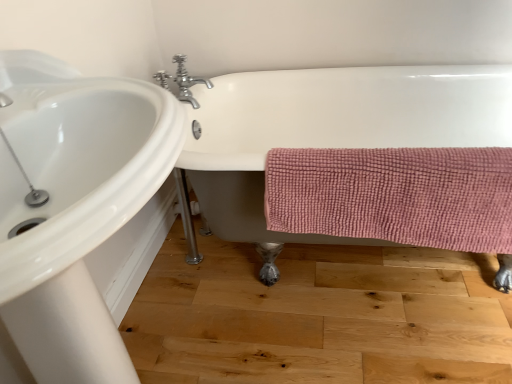
In order to click on white glossy bathtub at center in this screenshot , I will do `click(325, 132)`.

Identify the location of pink textured towel at lower right. The image size is (512, 384). (395, 195).

I want to click on chrome metallic faucet at upper center, so click(187, 82).

Could you tell me if chrome metallic faucet at upper center is facing pink textured towel at lower right?

No.

I want to click on bath towel that appears in front of the chrome metallic faucet at upper center, so click(395, 195).

Is chrome metallic faucet at upper center shorter than pink textured towel at lower right?

Yes, chrome metallic faucet at upper center is shorter than pink textured towel at lower right.

Which object is positioned more to the right, chrome metallic faucet at upper center or pink textured towel at lower right?

From the viewer's perspective, pink textured towel at lower right appears more on the right side.

Is white glossy bathtub at center smaller than white glossy sink at upper left?

Incorrect, white glossy bathtub at center is not smaller in size than white glossy sink at upper left.

I want to click on bathtub that appears on the right of white glossy sink at upper left, so click(325, 132).

Is point (277, 115) closer or farther from the camera than point (90, 153)?

Point (277, 115) is positioned farther from the camera compared to point (90, 153).

Do you think white glossy bathtub at center is within white glossy sink at upper left, or outside of it?

white glossy bathtub at center lies outside white glossy sink at upper left.

Which of these two, white glossy bathtub at center or chrome metallic faucet at upper center, stands shorter?

Standing shorter between the two is chrome metallic faucet at upper center.

Based on the photo, how different are the orientations of white glossy bathtub at center and chrome metallic faucet at upper center in degrees?

There is a 88.8-degree angle between the facing directions of white glossy bathtub at center and chrome metallic faucet at upper center.

Based on the photo, is there a large distance between white glossy bathtub at center and chrome metallic faucet at upper center?

They are positioned close to each other.

From the image's perspective, relative to chrome metallic faucet at upper center, is white glossy bathtub at center above or below?

white glossy bathtub at center is situated lower than chrome metallic faucet at upper center in the image.

What's the angular difference between white glossy sink at upper left and white glossy bathtub at center's facing directions?

There is a 89.4-degree angle between the facing directions of white glossy sink at upper left and white glossy bathtub at center.

Between white glossy sink at upper left and white glossy bathtub at center, which one has larger size?

With larger size is white glossy bathtub at center.

Is white glossy sink at upper left at the left side of white glossy bathtub at center?

Yes.

Is white glossy sink at upper left far from white glossy bathtub at center?

No, white glossy sink at upper left is not far from white glossy bathtub at center.

Is pink textured towel at lower right facing away from white glossy sink at upper left?

pink textured towel at lower right is not turned away from white glossy sink at upper left.

Is pink textured towel at lower right far from white glossy sink at upper left?

They are positioned close to each other.

Do you think pink textured towel at lower right is within white glossy sink at upper left, or outside of it?

pink textured towel at lower right is located beyond the bounds of white glossy sink at upper left.

Between pink textured towel at lower right and white glossy sink at upper left, which one is positioned in front?

white glossy sink at upper left is closer to the camera.

Does point (354, 151) lie behind point (291, 93)?

No, (354, 151) is closer to viewer.

Considering the relative positions of pink textured towel at lower right and white glossy bathtub at center in the image provided, is pink textured towel at lower right behind white glossy bathtub at center?

Yes, it is.

In terms of width, does pink textured towel at lower right look wider or thinner when compared to white glossy bathtub at center?

Clearly, pink textured towel at lower right has less width compared to white glossy bathtub at center.

Which is correct: pink textured towel at lower right is inside white glossy bathtub at center, or outside of it?

pink textured towel at lower right exists entirely within white glossy bathtub at center.

Does chrome metallic faucet at upper center have a larger size compared to white glossy bathtub at center?

Actually, chrome metallic faucet at upper center might be smaller than white glossy bathtub at center.

The image size is (512, 384). Identify the location of bathtub on the right of chrome metallic faucet at upper center. (325, 132).

Are chrome metallic faucet at upper center and white glossy bathtub at center located far from each other?

chrome metallic faucet at upper center is near white glossy bathtub at center, not far away.

Can you tell me how much chrome metallic faucet at upper center and white glossy bathtub at center differ in facing direction?

The facing directions of chrome metallic faucet at upper center and white glossy bathtub at center are 88.8 degrees apart.

You are a GUI agent. You are given a task and a screenshot of the screen. Output one action in this format:
    pyautogui.click(x=<x>, y=<y>)
    Task: Click on the bath towel lying on the right of chrome metallic faucet at upper center
    The image size is (512, 384).
    Given the screenshot: What is the action you would take?
    pyautogui.click(x=395, y=195)

You are a GUI agent. You are given a task and a screenshot of the screen. Output one action in this format:
    pyautogui.click(x=<x>, y=<y>)
    Task: Click on the sink in front of the white glossy bathtub at center
    The image size is (512, 384).
    Given the screenshot: What is the action you would take?
    pyautogui.click(x=73, y=206)

Looking at the image, which one is located closer to pink textured towel at lower right, white glossy bathtub at center or chrome metallic faucet at upper center?

white glossy bathtub at center is closer to pink textured towel at lower right.

Which object lies nearer to the anchor point white glossy bathtub at center, pink textured towel at lower right or chrome metallic faucet at upper center?

pink textured towel at lower right is positioned closer to the anchor white glossy bathtub at center.

Based on their spatial positions, is white glossy sink at upper left or pink textured towel at lower right closer to white glossy bathtub at center?

Based on the image, pink textured towel at lower right appears to be nearer to white glossy bathtub at center.

Based on their spatial positions, is pink textured towel at lower right or white glossy sink at upper left closer to chrome metallic faucet at upper center?

pink textured towel at lower right.

Considering their positions, is pink textured towel at lower right positioned closer to white glossy bathtub at center than white glossy sink at upper left?

Among the two, pink textured towel at lower right is located nearer to white glossy bathtub at center.

Based on their spatial positions, is white glossy sink at upper left or white glossy bathtub at center closer to pink textured towel at lower right?

The object closer to pink textured towel at lower right is white glossy bathtub at center.

Which object lies nearer to the anchor point white glossy sink at upper left, white glossy bathtub at center or pink textured towel at lower right?

pink textured towel at lower right lies closer to white glossy sink at upper left than the other object.

When comparing their distances from chrome metallic faucet at upper center, does white glossy sink at upper left or white glossy bathtub at center seem closer?

Based on the image, white glossy bathtub at center appears to be nearer to chrome metallic faucet at upper center.

Identify the location of bathtub between white glossy sink at upper left and chrome metallic faucet at upper center from front to back. (325, 132).

The height and width of the screenshot is (384, 512). Identify the location of bath towel between chrome metallic faucet at upper center and white glossy bathtub at center. (395, 195).

Locate an element on the screen. The image size is (512, 384). bath towel between white glossy sink at upper left and white glossy bathtub at center in the horizontal direction is located at coordinates (395, 195).

Find the location of a particular element. The image size is (512, 384). bath towel between white glossy sink at upper left and chrome metallic faucet at upper center in the front-back direction is located at coordinates (395, 195).